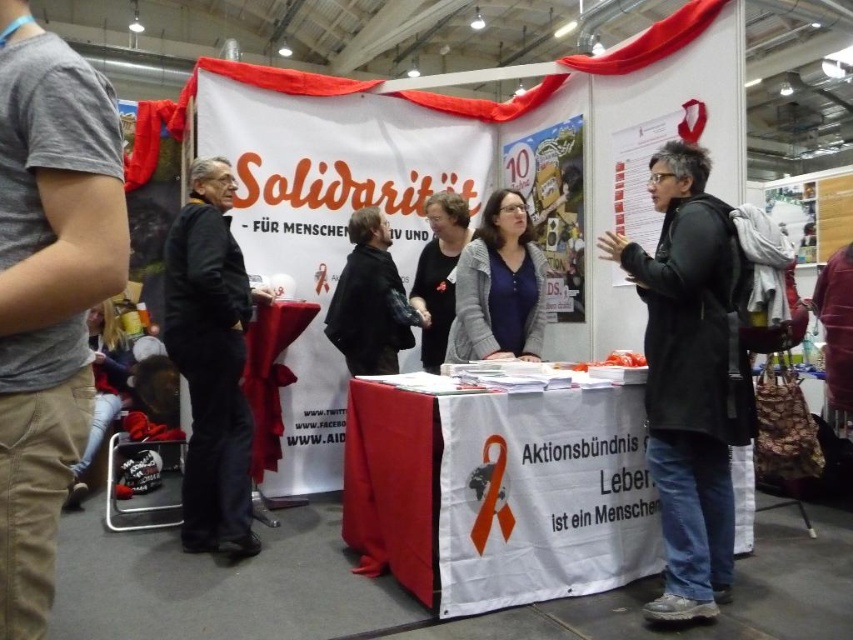
Question: Is black leather jacket at left positioned in front of matte black jacket at center?

Choices:
 (A) no
 (B) yes

Answer: (B)

Question: Is black leather jacket at left to the right of dark gray sweater at center from the viewer's perspective?

Choices:
 (A) no
 (B) yes

Answer: (A)

Question: Which object appears farthest from the camera in this image?

Choices:
 (A) matte gray sweater at center
 (B) white paper at center
 (C) black leather jacket at left

Answer: (A)

Question: Which of the following is the farthest from the observer?

Choices:
 (A) gray cotton t-shirt at left
 (B) matte black jacket at center
 (C) white paper at center

Answer: (B)

Question: Is gray cotton t-shirt at left in front of black leather jacket at left?

Choices:
 (A) yes
 (B) no

Answer: (A)

Question: Among these objects, which one is farthest from the camera?

Choices:
 (A) dark gray sweater at center
 (B) black leather jacket at left

Answer: (A)